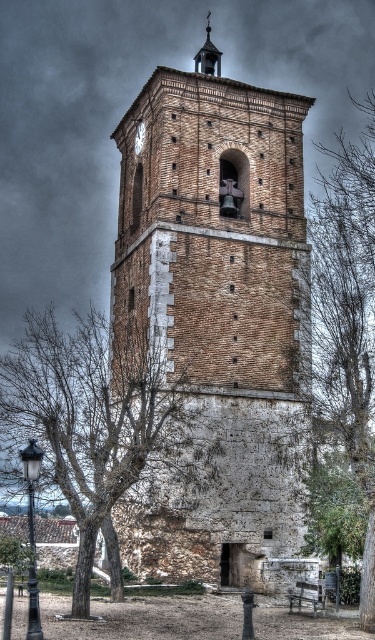
You are standing at the base of the historic bell tower and want to know if you can see the metallic clock at upper center from where the green leafy tree at right is located. Can you see it?

The distance between the green leafy tree at right and the metallic clock at upper center is 21.18 meters. Since there are no obstacles mentioned in the scene description, you should be able to see the metallic clock at upper center from the location of the green leafy tree at right.

You are standing in front of the bell tower and notice two points marked on the tower. One is at point coordinates point (x=360, y=161) and the other is at point coordinates point (x=139, y=145). Which point is closer to you?

Point (x=139, y=145) is closer to you because point (x=360, y=161) is further to the camera than point (x=139, y=145).